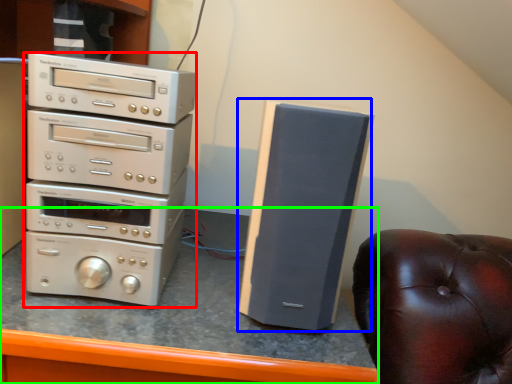
Question: Based on their relative distances, which object is farther from home appliance (highlighted by a red box)? Choose from speaker (highlighted by a blue box) and computer desk (highlighted by a green box).

Choices:
 (A) speaker
 (B) computer desk

Answer: (A)